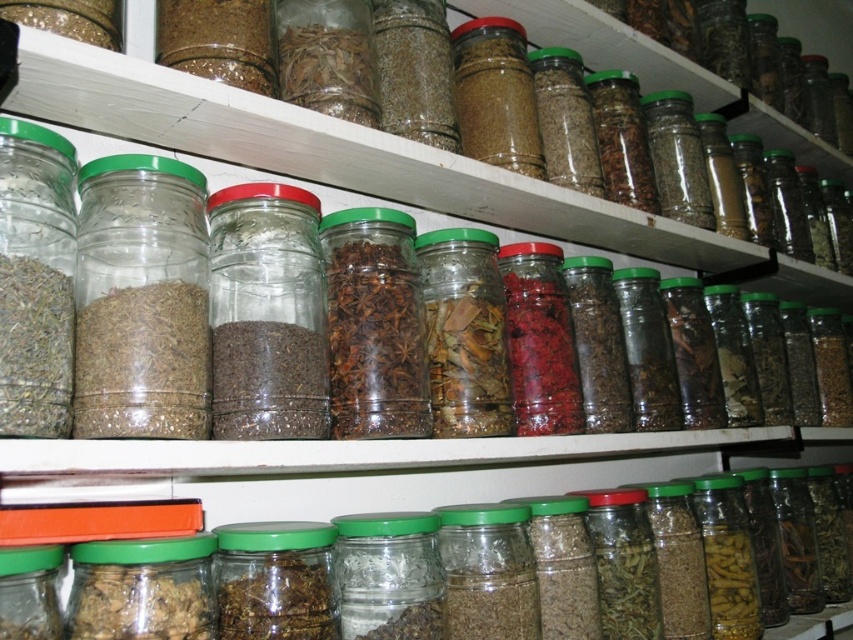
Who is lower down, brown matte star anise at center or green matte jar at center?

green matte jar at center is below.

Does brown matte star anise at center appear over green matte jar at center?

Yes.

Describe the element at coordinates (374, 324) in the screenshot. I see `brown matte star anise at center` at that location.

Where is `brown matte star anise at center`? The height and width of the screenshot is (640, 853). brown matte star anise at center is located at coordinates (374, 324).

Does translucent glass jar at left appear on the left side of brown matte spice at center?

Yes, translucent glass jar at left is to the left of brown matte spice at center.

Find the location of a particular element. translucent glass jar at left is located at coordinates (141, 300).

Does brown matte spice at center have a greater height compared to green matte glass jar at center?

Yes, brown matte spice at center is taller than green matte glass jar at center.

Does brown matte spice at center have a greater width compared to green matte glass jar at center?

No, brown matte spice at center is not wider than green matte glass jar at center.

Locate an element on the screen. The height and width of the screenshot is (640, 853). brown matte spice at center is located at coordinates (465, 332).

This screenshot has height=640, width=853. Identify the location of brown matte spice at center. (465, 332).